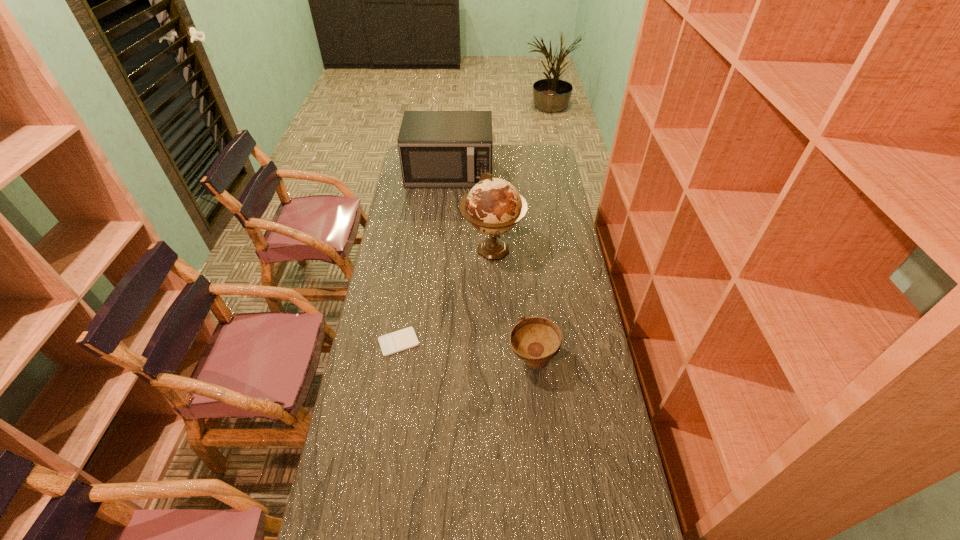
Find the location of a particular element. This screenshot has height=540, width=960. object that is positioned at the far edge is located at coordinates (x=438, y=149).

Find the location of a particular element. This screenshot has height=540, width=960. microwave oven that is at the left edge is located at coordinates (438, 149).

Where is `calculator that is at the left edge`? The height and width of the screenshot is (540, 960). calculator that is at the left edge is located at coordinates (400, 340).

Locate an element on the screen. This screenshot has width=960, height=540. object that is positioned at the right edge is located at coordinates (536, 340).

Locate an element on the screen. The image size is (960, 540). object located in the far left corner section of the desktop is located at coordinates (438, 149).

Locate an element on the screen. free space at the far edge of the desktop is located at coordinates (523, 160).

Where is `blank space at the left edge of the desktop`? blank space at the left edge of the desktop is located at coordinates (396, 235).

Find the location of a particular element. This screenshot has width=960, height=540. free space at the right edge of the desktop is located at coordinates (552, 309).

In the image, there is a desktop. Find the location of `free space at the far right corner`. free space at the far right corner is located at coordinates (534, 158).

This screenshot has width=960, height=540. I want to click on vacant space that's between the third tallest object and the calculator, so click(466, 351).